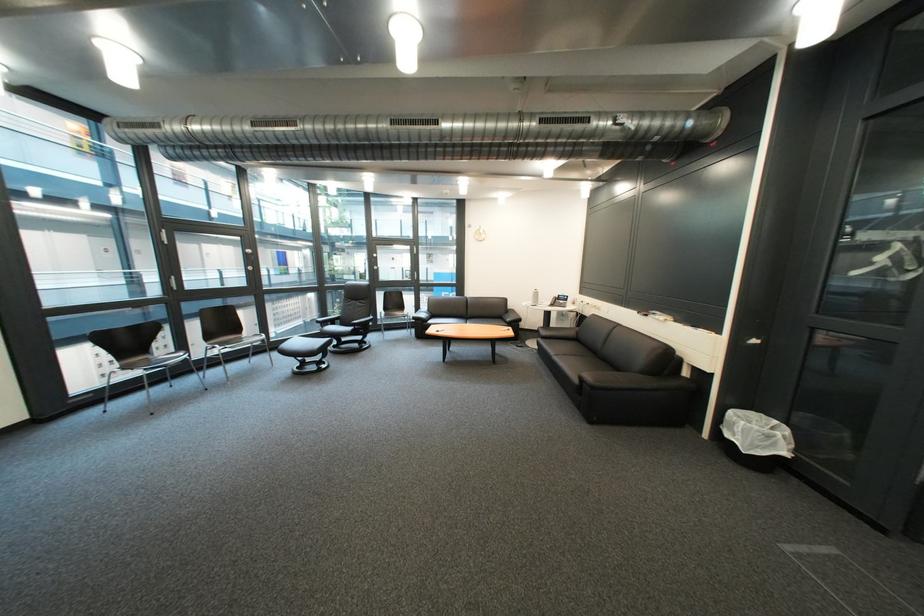
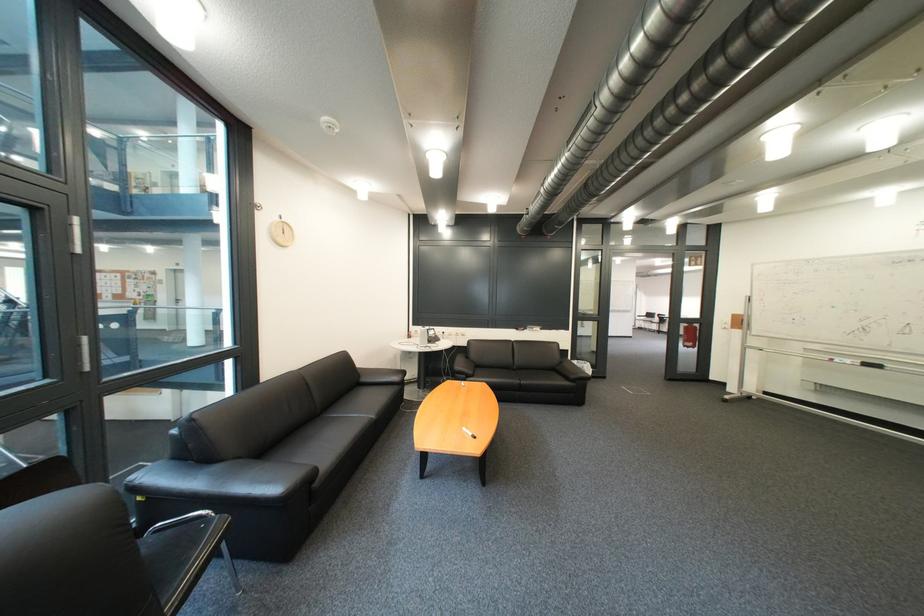
Where in the second image is the point corresponding to point 892,530 from the first image?

(618, 379)